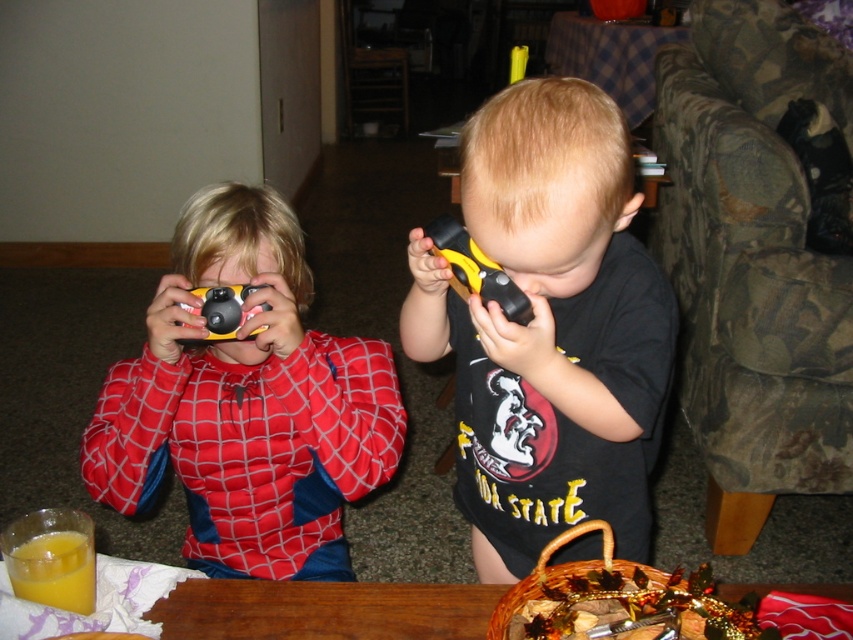
You are a delivery robot with a package that needs to be placed between the translucent glass at lower left and the matte black toy at center. The package measures 12 inches in length. Can you fit the package between them without tilting it?

The distance between the translucent glass at lower left and the matte black toy at center is 11.17 inches. Since the package is 12 inches long, it cannot fit between them without tilting.

You are a photographer trying to decide which camera to use for a wide shot. You have two options in the scene, the matte plastic camera at left and the translucent glass at lower left. Which camera is wider?

The matte plastic camera at left is wider than the translucent glass at lower left according to the description.

You are a parent trying to organize your childrens toys. You have a small toy box that can only hold items smaller than the matte plastic camera at left. Can the black matte toy phone at center fit into the toy box?

The black matte toy phone at center is smaller than the matte plastic camera at left, so it can fit into the toy box.